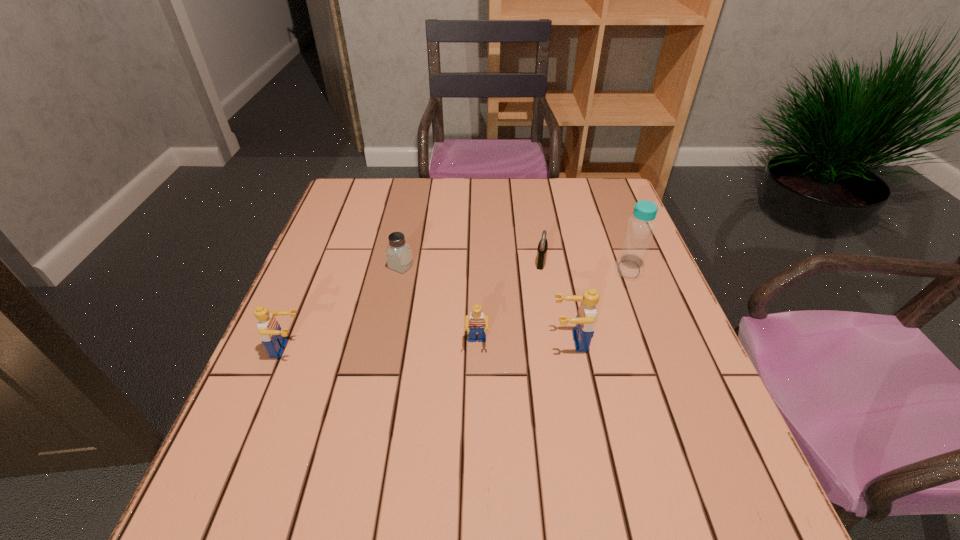
In the image, there is a desktop. Where is `vacant space at the far edge`? Image resolution: width=960 pixels, height=540 pixels. vacant space at the far edge is located at coordinates (543, 204).

In the image, there is a desktop. Identify the location of free space at the near edge. The width and height of the screenshot is (960, 540). (500, 446).

At what (x,y) coordinates should I click in order to perform the action: click on free region at the left edge of the desktop. Please return your answer as a coordinate pair (x, y). Looking at the image, I should click on (335, 225).

This screenshot has height=540, width=960. I want to click on free space at the right edge of the desktop, so click(668, 329).

Identify the location of free spot at the far left corner of the desktop. (365, 219).

This screenshot has height=540, width=960. I want to click on blank area at the near left corner, so click(257, 436).

Where is `vacant region at the far right corner of the desktop`? vacant region at the far right corner of the desktop is located at coordinates (591, 212).

Where is `free space at the near right corner of the desktop`? This screenshot has height=540, width=960. free space at the near right corner of the desktop is located at coordinates (656, 442).

I want to click on vacant space that is in between the fourth object from right to left and the leftmost object, so click(382, 347).

I want to click on free space between the second tallest Lego and the shortest Lego, so tap(382, 347).